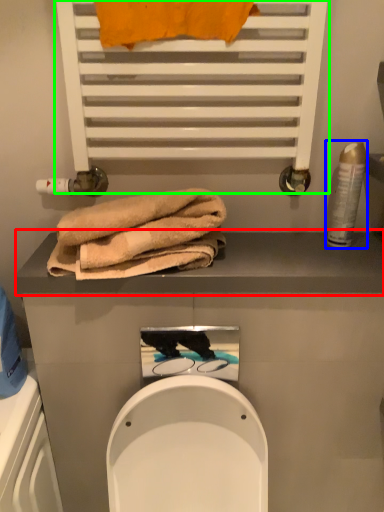
Question: Considering the real-world distances, which object is closest to balustrade (highlighted by a red box)? toiletry (highlighted by a blue box) or shelf (highlighted by a green box).

Choices:
 (A) toiletry
 (B) shelf

Answer: (A)